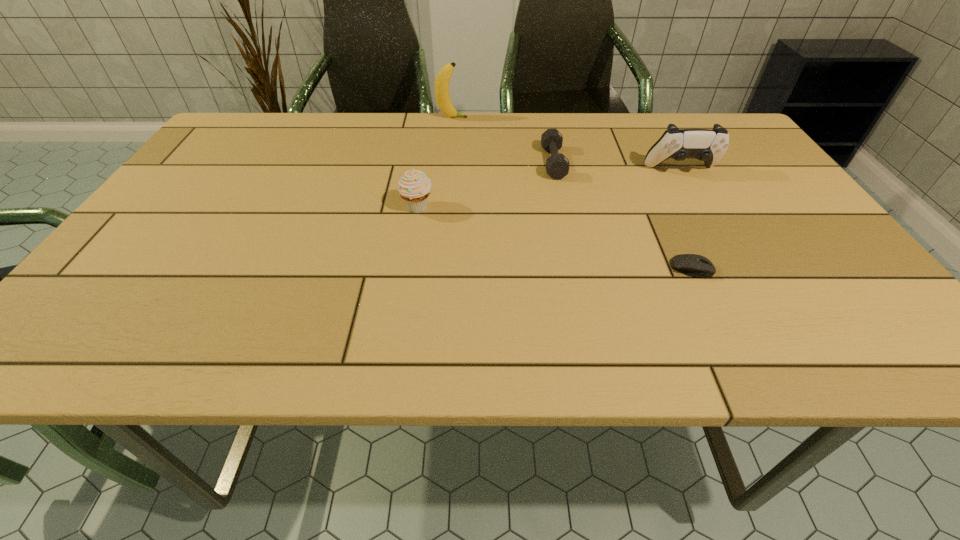
Identify the location of blank space located 0.400m on the front-facing side of the control. The image size is (960, 540). (757, 302).

Locate an element on the screen. free space located 0.300m on the back of the second nearest object is located at coordinates (429, 134).

I want to click on vacant space situated on the right of the second shortest object, so click(x=611, y=163).

At what (x,y) coordinates should I click in order to perform the action: click on vacant space located 0.290m on the left of the nearest object. Please return your answer as a coordinate pair (x, y). Image resolution: width=960 pixels, height=540 pixels. Looking at the image, I should click on (523, 268).

This screenshot has height=540, width=960. Identify the location of banana located in the far edge section of the desktop. (442, 80).

Image resolution: width=960 pixels, height=540 pixels. I want to click on dumbbell present at the far edge, so click(557, 165).

At what (x,y) coordinates should I click in order to perform the action: click on object at the right edge. Please return your answer as a coordinate pair (x, y). The width and height of the screenshot is (960, 540). Looking at the image, I should click on (706, 145).

In the image, there is a desktop. Identify the location of vacant space at the far edge. This screenshot has height=540, width=960. (450, 134).

Identify the location of free region at the near edge of the desktop. Image resolution: width=960 pixels, height=540 pixels. (738, 356).

In the image, there is a desktop. At what (x,y) coordinates should I click in order to perform the action: click on blank space at the left edge. Please return your answer as a coordinate pair (x, y). Looking at the image, I should click on (192, 186).